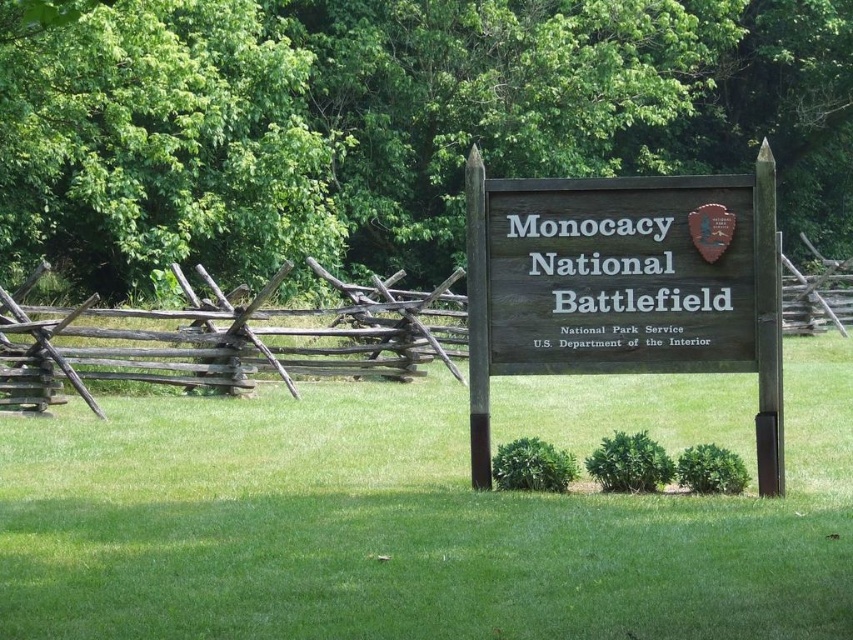
Question: Among these points, which one is nearest to the camera?

Choices:
 (A) (547, 618)
 (B) (421, 371)
 (C) (778, 132)
 (D) (426, 301)

Answer: (A)

Question: Which point appears closest to the camera in this image?

Choices:
 (A) (231, 372)
 (B) (20, 188)
 (C) (469, 179)
 (D) (28, 397)

Answer: (C)

Question: Which of these objects is positioned farthest from the weathered wood fence at center?

Choices:
 (A) weathered wood fence at left
 (B) green grass at center
 (C) green leafy tree at upper center
 (D) wooden sign at center

Answer: (D)

Question: Does green grass at center have a lesser width compared to wooden sign at center?

Choices:
 (A) yes
 (B) no

Answer: (B)

Question: Does green grass at center appear under wooden sign at center?

Choices:
 (A) no
 (B) yes

Answer: (B)

Question: Is green grass at center positioned in front of wooden sign at center?

Choices:
 (A) no
 (B) yes

Answer: (B)